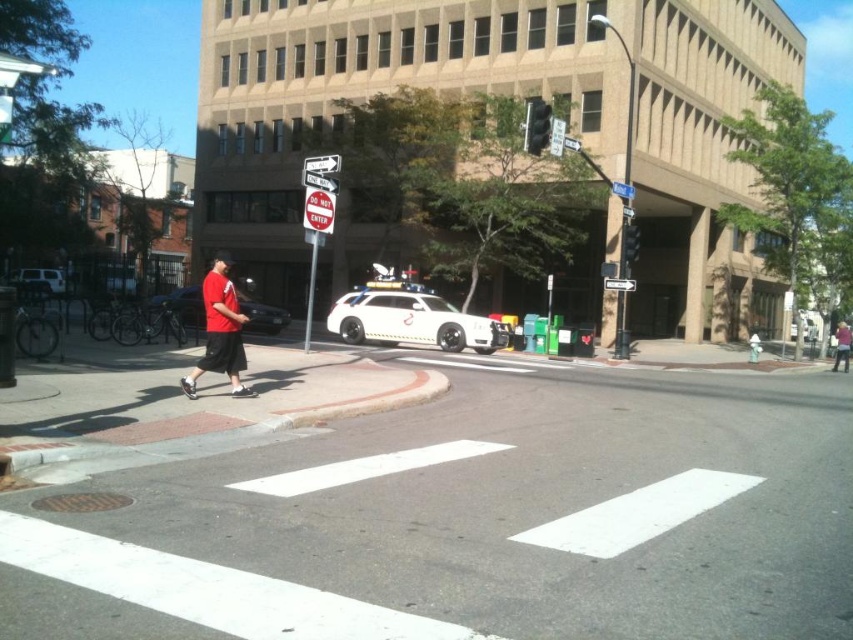
Which is below, white glossy car at left or metallic traffic light at upper right?

Positioned lower is white glossy car at left.

Identify the location of white glossy car at left. This screenshot has width=853, height=640. (39, 280).

Locate an element on the screen. white glossy car at left is located at coordinates click(39, 280).

Consider the image. Is white glossy suv at center closer to camera compared to metallic traffic light at upper right?

Yes.

Does white glossy suv at center have a larger size compared to metallic traffic light at upper right?

No.

Describe the element at coordinates (410, 321) in the screenshot. I see `white glossy suv at center` at that location.

Locate an element on the screen. white glossy suv at center is located at coordinates (410, 321).

Which is in front, point (283, 316) or point (631, 227)?

Positioned in front is point (631, 227).

Can you confirm if red matte shirt at left is wider than metallic traffic light at upper right?

Yes, red matte shirt at left is wider than metallic traffic light at upper right.

You are a GUI agent. You are given a task and a screenshot of the screen. Output one action in this format:
    pyautogui.click(x=<x>, y=<y>)
    Task: Click on the red matte shirt at left
    The width and height of the screenshot is (853, 640).
    Given the screenshot: What is the action you would take?
    click(183, 305)